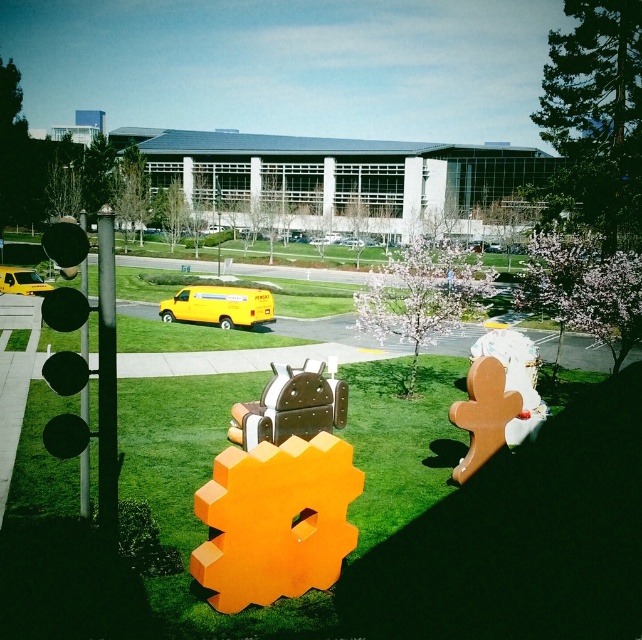
Question: Which object is farther from the camera taking this photo?

Choices:
 (A) yellow matte van at center
 (B) yellow matte van at left

Answer: (B)

Question: Does yellow matte van at center have a larger size compared to yellow matte van at left?

Choices:
 (A) no
 (B) yes

Answer: (B)

Question: Can you confirm if yellow matte van at center is positioned below yellow matte van at left?

Choices:
 (A) yes
 (B) no

Answer: (A)

Question: Among these objects, which one is farthest from the camera?

Choices:
 (A) yellow matte van at center
 (B) yellow matte van at left

Answer: (B)

Question: Can you confirm if yellow matte van at center is wider than yellow matte van at left?

Choices:
 (A) yes
 (B) no

Answer: (A)